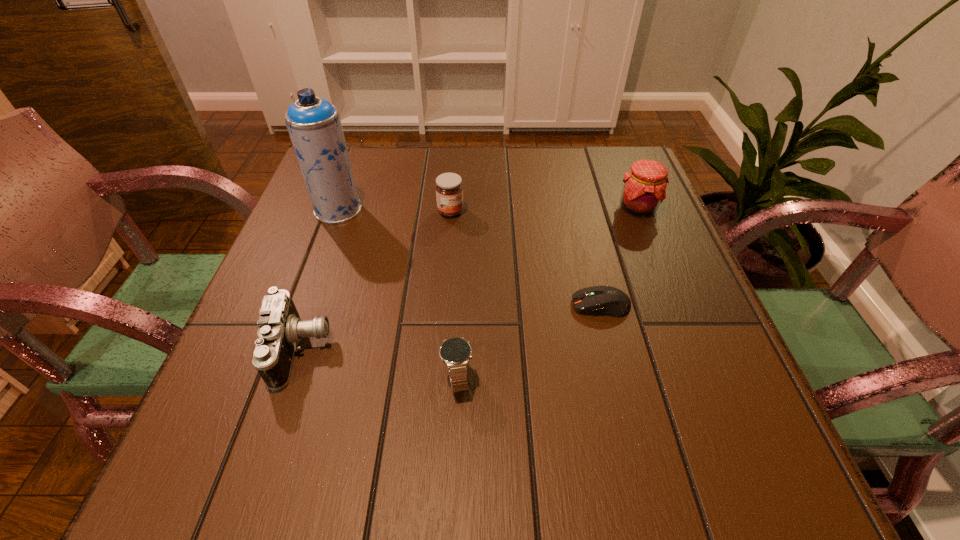
Identify which object is located as the second nearest to the watch. Please provide its 2D coordinates. Your answer should be formatted as a tuple, i.e. [(x, y)], where the tuple contains the x and y coordinates of a point satisfying the conditions above.

[(607, 300)]

This screenshot has width=960, height=540. What are the coordinates of `free spot that satisfies the following two spatial constraints: 1. on the front side of the shorter jam; 2. on the left side of the watch` in the screenshot? It's located at (438, 378).

Image resolution: width=960 pixels, height=540 pixels. I want to click on free location that satisfies the following two spatial constraints: 1. on the front side of the watch; 2. on the left side of the shorter jam, so click(x=438, y=378).

This screenshot has width=960, height=540. I want to click on free space in the image that satisfies the following two spatial constraints: 1. on the front side of the taller jam; 2. at the lens of the camera, so click(696, 350).